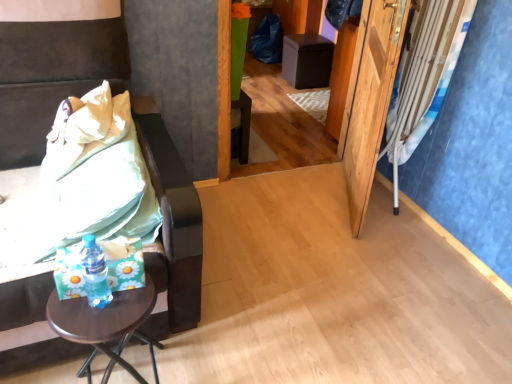
Find the location of `unoccupied region to the right of brown wooden table at lower left`. unoccupied region to the right of brown wooden table at lower left is located at coordinates (211, 363).